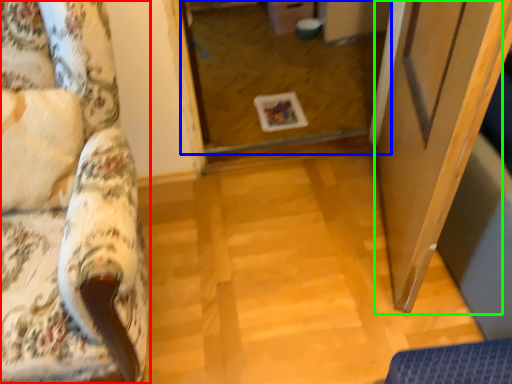
Question: Which object is positioned closest to furniture (highlighted by a red box)? Select from glass door (highlighted by a blue box) and screen door (highlighted by a green box).

Choices:
 (A) glass door
 (B) screen door

Answer: (B)